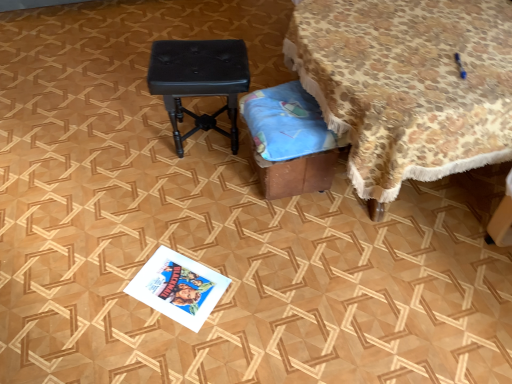
What are the coordinates of `free spot to the left of brown cardboard box at lower center` in the screenshot? It's located at (212, 192).